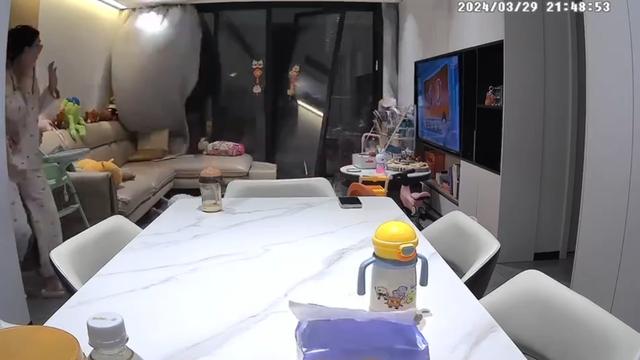
Identify the location of floor. (557, 266).